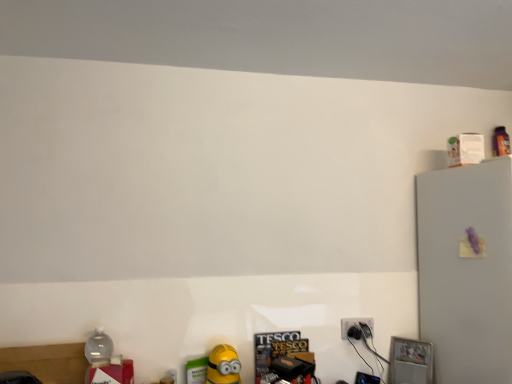
Question: Are black plastic power plugs and sockets at lower right and yellow matte toy at lower center making contact?

Choices:
 (A) yes
 (B) no

Answer: (B)

Question: Considering the relative positions of black plastic power plugs and sockets at lower right and yellow matte toy at lower center in the image provided, is black plastic power plugs and sockets at lower right behind yellow matte toy at lower center?

Choices:
 (A) yes
 (B) no

Answer: (A)

Question: From a real-world perspective, is black plastic power plugs and sockets at lower right positioned over yellow matte toy at lower center based on gravity?

Choices:
 (A) yes
 (B) no

Answer: (A)

Question: Does black plastic power plugs and sockets at lower right have a larger size compared to yellow matte toy at lower center?

Choices:
 (A) yes
 (B) no

Answer: (B)

Question: Is black plastic power plugs and sockets at lower right facing away from yellow matte toy at lower center?

Choices:
 (A) yes
 (B) no

Answer: (B)

Question: Is yellow matte toy at lower center spatially inside white matte refrigerator at upper right, or outside of it?

Choices:
 (A) inside
 (B) outside

Answer: (B)

Question: In terms of height, does yellow matte toy at lower center look taller or shorter compared to white matte refrigerator at upper right?

Choices:
 (A) tall
 (B) short

Answer: (B)

Question: Looking at their shapes, would you say yellow matte toy at lower center is wider or thinner than white matte refrigerator at upper right?

Choices:
 (A) thin
 (B) wide

Answer: (A)

Question: Visually, is yellow matte toy at lower center positioned to the left or to the right of white matte refrigerator at upper right?

Choices:
 (A) left
 (B) right

Answer: (A)

Question: In the image, is black plastic power plugs and sockets at lower right positioned in front of or behind white matte refrigerator at upper right?

Choices:
 (A) front
 (B) behind

Answer: (B)

Question: From a real-world perspective, relative to white matte refrigerator at upper right, is black plastic power plugs and sockets at lower right vertically above or below?

Choices:
 (A) above
 (B) below

Answer: (B)

Question: Is black plastic power plugs and sockets at lower right inside the boundaries of white matte refrigerator at upper right, or outside?

Choices:
 (A) inside
 (B) outside

Answer: (B)

Question: From the image's perspective, relative to white matte refrigerator at upper right, is black plastic power plugs and sockets at lower right above or below?

Choices:
 (A) below
 (B) above

Answer: (A)

Question: Is black plastic power plugs and sockets at lower right in front of or behind yellow matte toy at lower center in the image?

Choices:
 (A) front
 (B) behind

Answer: (B)

Question: Is black plastic power plugs and sockets at lower right inside or outside of yellow matte toy at lower center?

Choices:
 (A) outside
 (B) inside

Answer: (A)